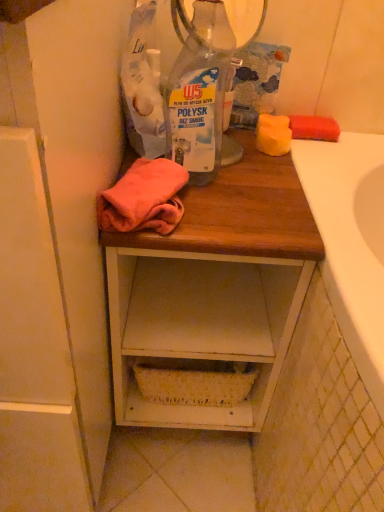
You are a GUI agent. You are given a task and a screenshot of the screen. Output one action in this format:
    pyautogui.click(x=<x>, y=<y>)
    Task: Click on the free space above wooden desk at center (from a real-world perspective)
    This screenshot has height=512, width=384.
    Given the screenshot: What is the action you would take?
    pyautogui.click(x=236, y=177)